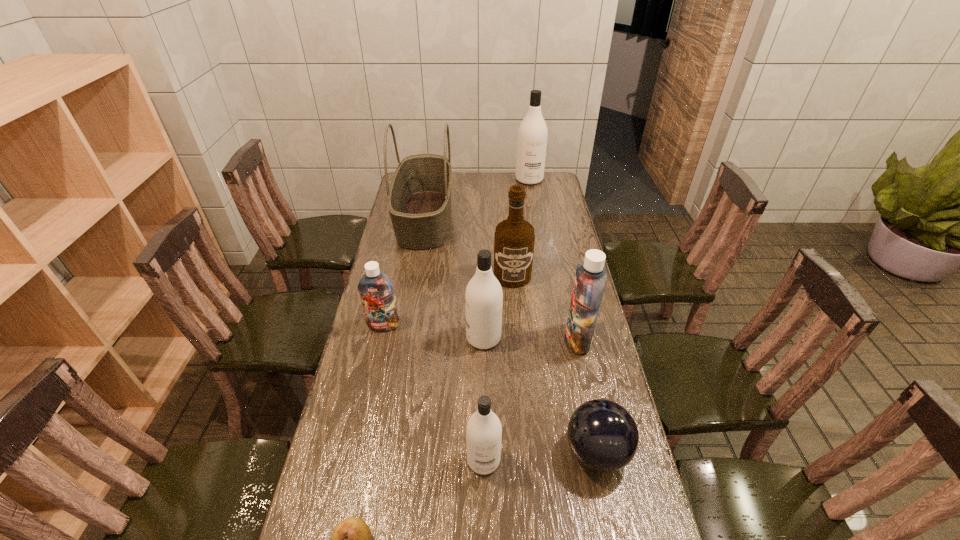
At what (x,y) coordinates should I click in order to perform the action: click on shampoo at the left edge. Please return your answer as a coordinate pair (x, y). The width and height of the screenshot is (960, 540). Looking at the image, I should click on (376, 290).

Where is `bowling ball present at the right edge`? bowling ball present at the right edge is located at coordinates (602, 434).

Where is `object located in the far left corner section of the desktop`? Image resolution: width=960 pixels, height=540 pixels. object located in the far left corner section of the desktop is located at coordinates (419, 200).

Image resolution: width=960 pixels, height=540 pixels. Identify the location of object present at the far right corner. (532, 135).

The width and height of the screenshot is (960, 540). In order to click on vacant point at the left edge in this screenshot , I will do `click(362, 340)`.

What are the coordinates of `free space at the right edge` in the screenshot? It's located at (558, 345).

Where is `free spot between the left blue shampoo and the basket`? The image size is (960, 540). free spot between the left blue shampoo and the basket is located at coordinates (404, 272).

Locate an element on the screen. Image resolution: width=960 pixels, height=540 pixels. free area in between the bowling ball and the eighth nearest object is located at coordinates (511, 335).

Where is `free spot between the right blue shampoo and the smallest white shampoo`? free spot between the right blue shampoo and the smallest white shampoo is located at coordinates click(531, 400).

Identify the location of free space between the basket and the farthest object. The image size is (960, 540). (477, 199).